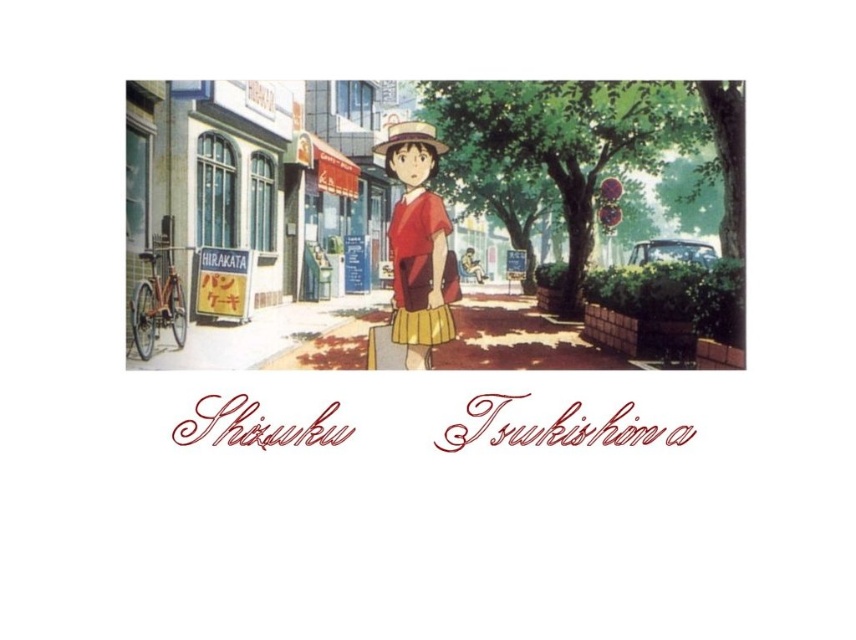
Is matte red shirt at center below strawmaterial/texture hat at center?

Yes.

Which of these two, matte red shirt at center or strawmaterial/texture hat at center, stands shorter?

Standing shorter between the two is matte red shirt at center.

I want to click on matte red shirt at center, so click(x=418, y=244).

Locate an element on the screen. matte red shirt at center is located at coordinates (418, 244).

Is the position of yellow paper sign at left more distant than that of strawmaterial/texture hat at center?

Yes, it is.

Who is positioned more to the right, yellow paper sign at left or strawmaterial/texture hat at center?

Positioned to the right is strawmaterial/texture hat at center.

Measure the distance between yellow paper sign at left and camera.

The distance of yellow paper sign at left from camera is 10.69 meters.

Where is `yellow paper sign at left`? yellow paper sign at left is located at coordinates (223, 282).

Can you confirm if matte red shirt at center is positioned to the right of yellow paper sign at left?

Correct, you'll find matte red shirt at center to the right of yellow paper sign at left.

Which is below, matte red shirt at center or yellow paper sign at left?

matte red shirt at center

Does point (409, 234) come closer to viewer compared to point (203, 260)?

Yes, it is.

This screenshot has width=856, height=640. In order to click on matte red shirt at center in this screenshot , I will do `click(418, 244)`.